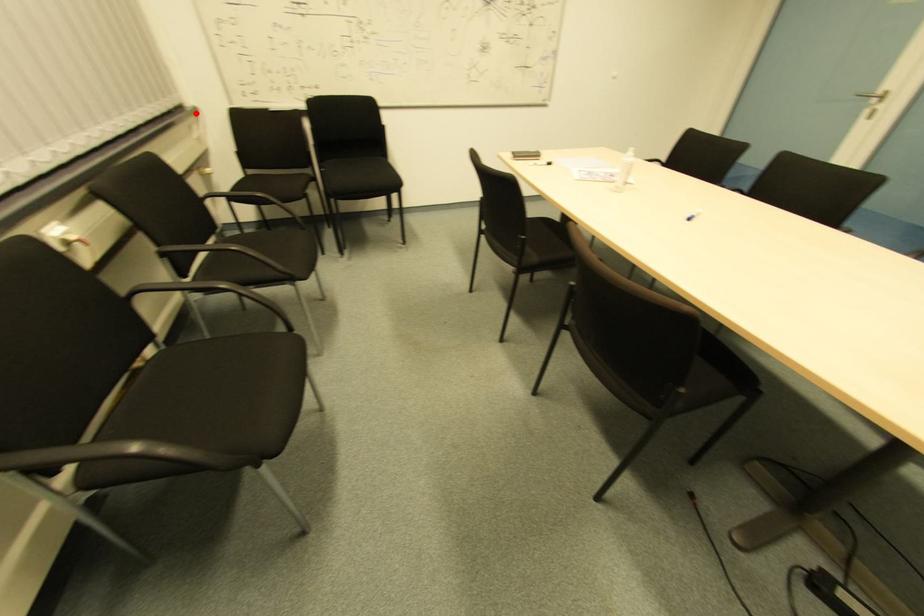
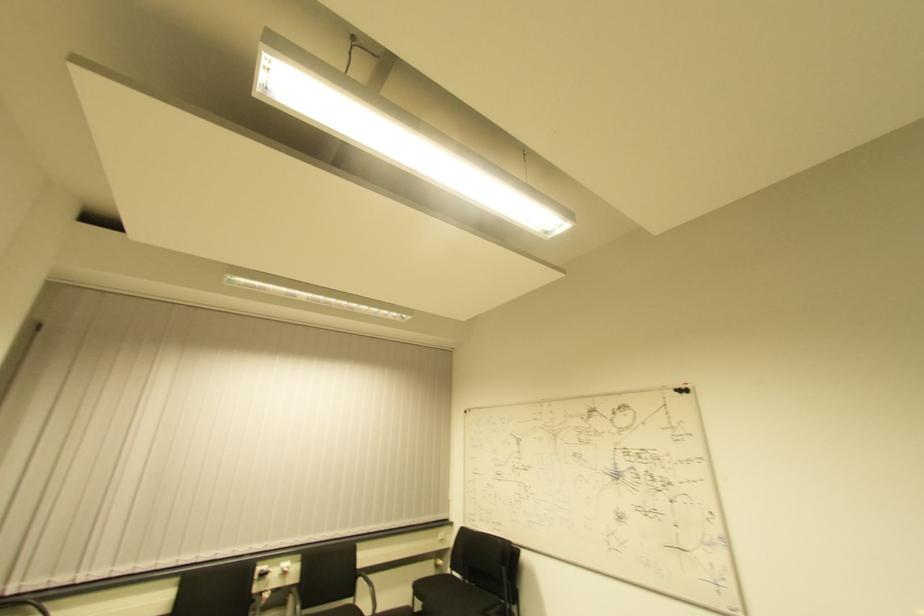
Find the pixel in the second image that matches the highlighted location in the first image.

(450, 527)